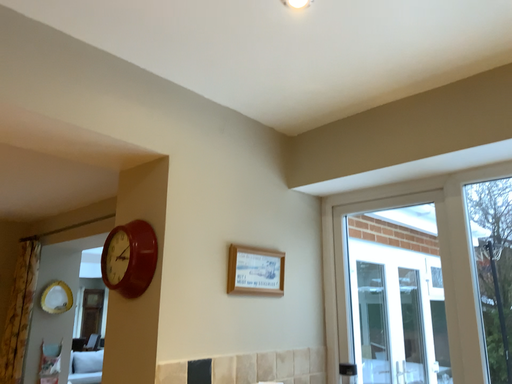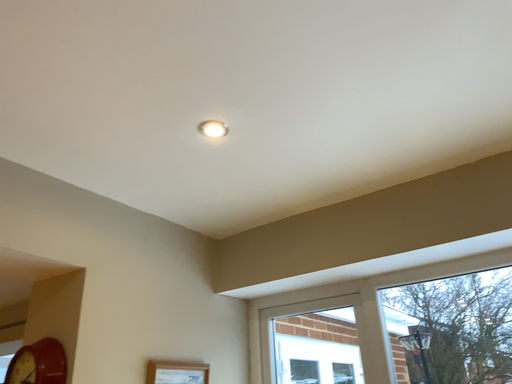
Question: Which way did the camera rotate in the video?

Choices:
 (A) rotated downward
 (B) rotated upward

Answer: (B)